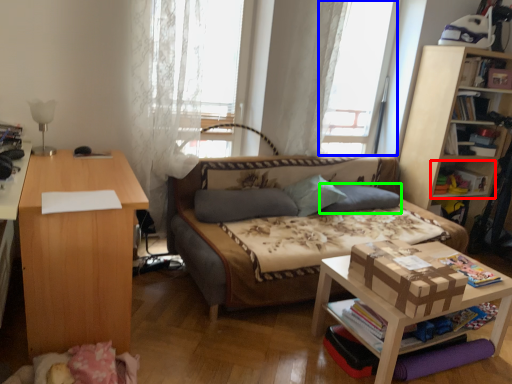
Question: Estimate the real-world distances between objects in this image. Which object is farther from shelf (highlighted by a red box), window screen (highlighted by a blue box) or pillow (highlighted by a green box)?

Choices:
 (A) window screen
 (B) pillow

Answer: (A)